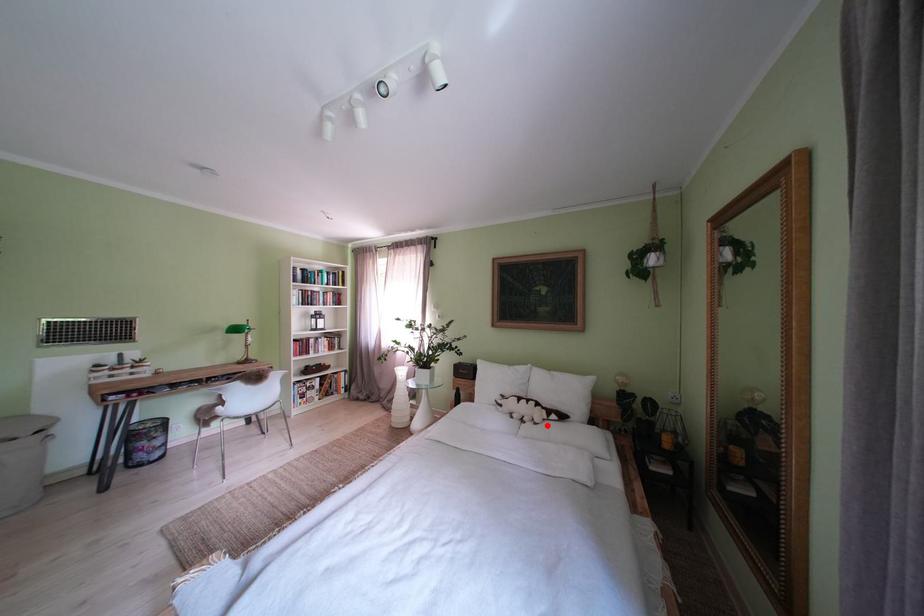
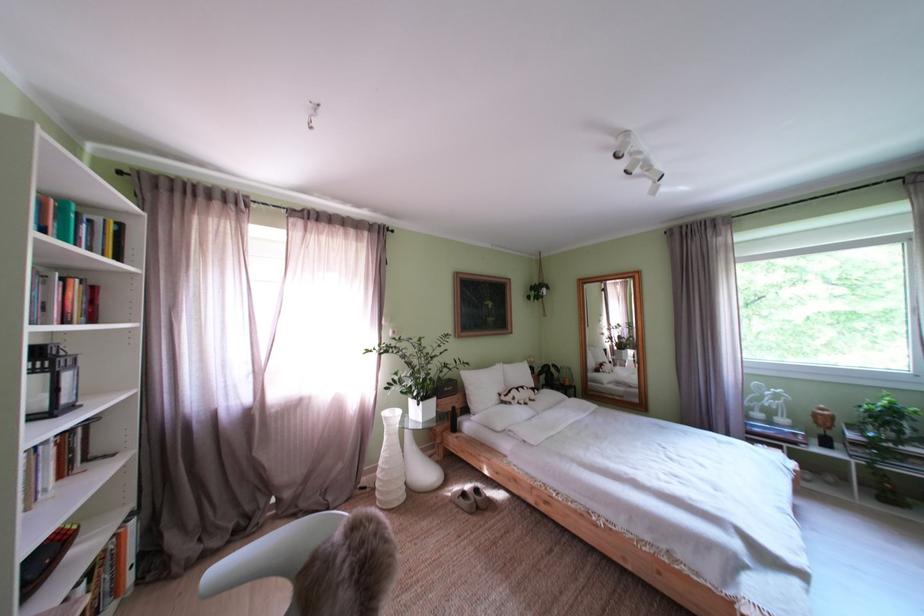
Where in the second image is the point corresponding to the highlighted location from the first image?

(543, 403)